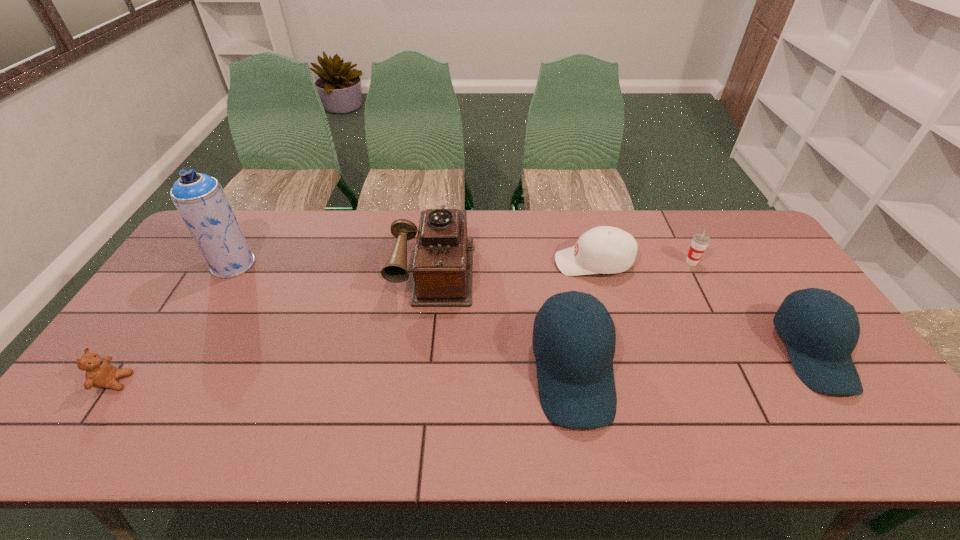
You are a GUI agent. You are given a task and a screenshot of the screen. Output one action in this format:
    pyautogui.click(x=<x>, y=<y>)
    Task: Click on the vacant region at the far right corner of the desktop
    
    Given the screenshot: What is the action you would take?
    pyautogui.click(x=743, y=235)

Identify the location of vacant area that lies between the tallest baseball cap and the rightmost baseball cap. (692, 363).

Where is `free space between the tallest baseball cap and the leftmost object`? This screenshot has width=960, height=540. free space between the tallest baseball cap and the leftmost object is located at coordinates click(344, 377).

Where is `free spot between the third object from left to right and the rightmost baseball cap`? Image resolution: width=960 pixels, height=540 pixels. free spot between the third object from left to right and the rightmost baseball cap is located at coordinates (623, 310).

Find the location of a particular element. This screenshot has width=960, height=540. vacant area that lies between the rightmost baseball cap and the leftmost object is located at coordinates point(464,368).

Where is `vacant area that lies between the leftmost object and the farthest baseball cap`? The width and height of the screenshot is (960, 540). vacant area that lies between the leftmost object and the farthest baseball cap is located at coordinates (354, 322).

Locate an element on the screen. vacant point located between the tallest object and the tallest baseball cap is located at coordinates (403, 318).

This screenshot has height=540, width=960. I want to click on free area in between the teddy bear and the fifth object from right to left, so click(x=275, y=325).

This screenshot has height=540, width=960. In order to click on unoccupied position between the rightmost baseball cap and the farthest baseball cap in this screenshot , I will do `click(703, 308)`.

Select which object appears as the closest to the tallest baseball cap. Please provide its 2D coordinates. Your answer should be formatted as a tuple, i.e. [(x, y)], where the tuple contains the x and y coordinates of a point satisfying the conditions above.

[(442, 269)]